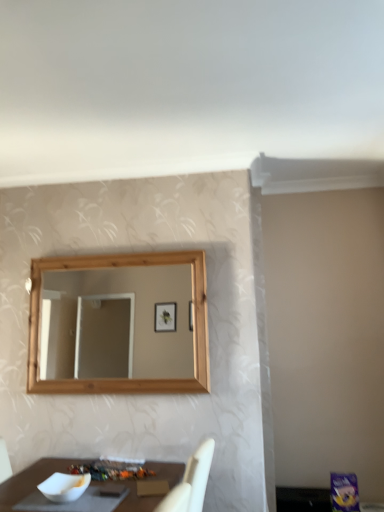
Find the location of a particular element. Image resolution: width=384 pixels, height=512 pixels. free space above white matte bowl at lower left (from a real-world perspective) is located at coordinates (60, 481).